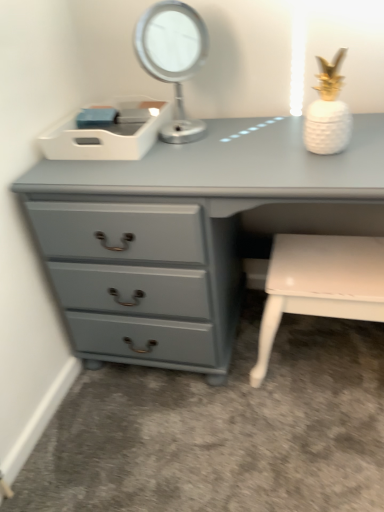
Image resolution: width=384 pixels, height=512 pixels. What do you see at coordinates (188, 232) in the screenshot?
I see `matte gray chest of drawers at center` at bounding box center [188, 232].

What is the approximate width of white glossy bench at lower right?

white glossy bench at lower right is 14.76 inches wide.

Identify the location of matte gray chest of drawers at center. (188, 232).

From the image's perspective, who appears lower, metallic silver table lamp at upper center or matte gray chest of drawers at center?

matte gray chest of drawers at center.

Is point (161, 25) positioned behind point (151, 343)?

No, it is in front of (151, 343).

Between metallic silver table lamp at upper center and matte gray chest of drawers at center, which one appears on the left side from the viewer's perspective?

Positioned to the left is metallic silver table lamp at upper center.

Based on their sizes in the image, would you say metallic silver table lamp at upper center is bigger or smaller than matte gray chest of drawers at center?

metallic silver table lamp at upper center is smaller than matte gray chest of drawers at center.

Is metallic silver table lamp at upper center aimed at white glossy bench at lower right?

No, metallic silver table lamp at upper center is not aimed at white glossy bench at lower right.

Can you see metallic silver table lamp at upper center touching white glossy bench at lower right?

No.

From a real-world perspective, is metallic silver table lamp at upper center physically below white glossy bench at lower right?

No, from a real-world perspective, metallic silver table lamp at upper center is not below white glossy bench at lower right.

From the image's perspective, which is above, metallic silver table lamp at upper center or white glossy bench at lower right?

From the image's view, metallic silver table lamp at upper center is above.

Is matte gray chest of drawers at center wider or thinner than white glossy bench at lower right?

Considering their sizes, matte gray chest of drawers at center looks broader than white glossy bench at lower right.

Is matte gray chest of drawers at center taller or shorter than white glossy bench at lower right?

Clearly, matte gray chest of drawers at center is taller compared to white glossy bench at lower right.

Is matte gray chest of drawers at center oriented away from white glossy bench at lower right?

Yes, matte gray chest of drawers at center is positioned with its back facing white glossy bench at lower right.

Is matte gray chest of drawers at center beside white glossy bench at lower right?

matte gray chest of drawers at center and white glossy bench at lower right are not in contact.

Is metallic silver table lamp at upper center at the back of matte gray chest of drawers at center?

matte gray chest of drawers at center does not have its back to metallic silver table lamp at upper center.

From the image's perspective, which one is positioned lower, matte gray chest of drawers at center or metallic silver table lamp at upper center?

matte gray chest of drawers at center is shown below in the image.

How distant is matte gray chest of drawers at center from metallic silver table lamp at upper center?

The distance of matte gray chest of drawers at center from metallic silver table lamp at upper center is 12.49 inches.

Where is `the chest of drawers in front of the metallic silver table lamp at upper center`? The height and width of the screenshot is (512, 384). the chest of drawers in front of the metallic silver table lamp at upper center is located at coordinates pyautogui.click(x=188, y=232).

Can you tell me how much white glossy bench at lower right and matte gray chest of drawers at center differ in facing direction?

0.000375 degrees.

Is matte gray chest of drawers at center located within white glossy bench at lower right?

No, matte gray chest of drawers at center is not a part of white glossy bench at lower right.

Is white glossy bench at lower right oriented away from matte gray chest of drawers at center?

Yes, matte gray chest of drawers at center is at the back of white glossy bench at lower right.

Does white glossy bench at lower right lie in front of matte gray chest of drawers at center?

No, white glossy bench at lower right is further to the viewer.

Visually, is white glossy bench at lower right positioned to the left or to the right of metallic silver table lamp at upper center?

white glossy bench at lower right is to the right of metallic silver table lamp at upper center.

How different are the orientations of white glossy bench at lower right and metallic silver table lamp at upper center in degrees?

32.6 degrees.

Is white glossy bench at lower right inside the boundaries of metallic silver table lamp at upper center, or outside?

white glossy bench at lower right is not inside metallic silver table lamp at upper center, it's outside.

At what (x,y) coordinates should I click in order to perform the action: click on table lamp behind the matte gray chest of drawers at center. Please return your answer as a coordinate pair (x, y). The image size is (384, 512). Looking at the image, I should click on (173, 58).

The image size is (384, 512). In order to click on chair that is on the right side of metallic silver table lamp at upper center in this screenshot , I will do `click(320, 284)`.

Estimate the real-world distances between objects in this image. Which object is further from metallic silver table lamp at upper center, matte gray chest of drawers at center or white glossy bench at lower right?

white glossy bench at lower right is further to metallic silver table lamp at upper center.

Which object lies nearer to the anchor point matte gray chest of drawers at center, white glossy bench at lower right or metallic silver table lamp at upper center?

metallic silver table lamp at upper center is closer to matte gray chest of drawers at center.

Considering their positions, is metallic silver table lamp at upper center positioned closer to matte gray chest of drawers at center than white glossy bench at lower right?

Among the two, metallic silver table lamp at upper center is located nearer to matte gray chest of drawers at center.

Estimate the real-world distances between objects in this image. Which object is further from white glossy bench at lower right, metallic silver table lamp at upper center or matte gray chest of drawers at center?

metallic silver table lamp at upper center.

Looking at the image, which one is located further to metallic silver table lamp at upper center, white glossy bench at lower right or matte gray chest of drawers at center?

Among the two, white glossy bench at lower right is located further to metallic silver table lamp at upper center.

From the picture: Based on their spatial positions, is matte gray chest of drawers at center or metallic silver table lamp at upper center closer to white glossy bench at lower right?

matte gray chest of drawers at center is closer to white glossy bench at lower right.

In order to click on chest of drawers between metallic silver table lamp at upper center and white glossy bench at lower right in the vertical direction in this screenshot , I will do `click(188, 232)`.